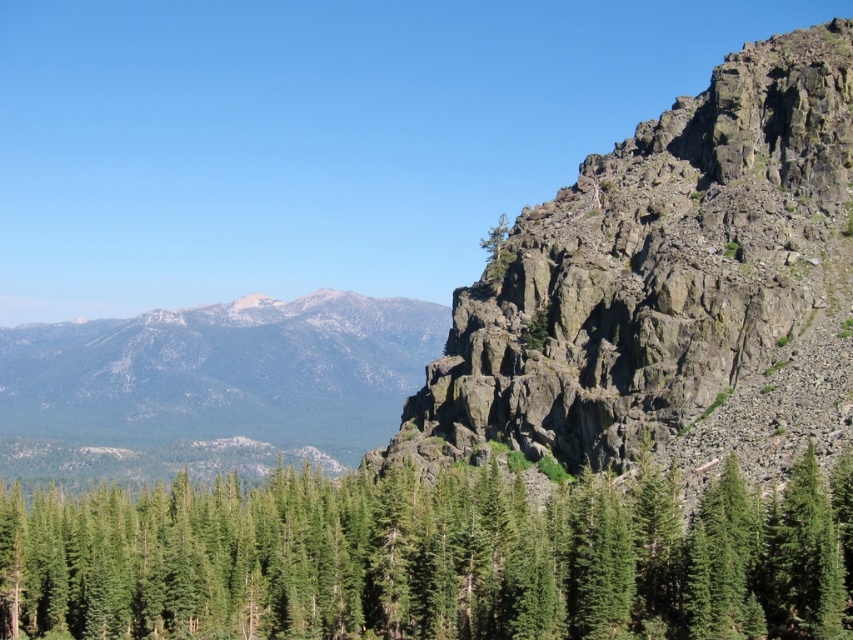
You are a hiker standing at the base of the cliff on the right side of the image. You want to take a photo of the green matte tree at center from your current position. Will the cliff block your view of the tree?

The green matte tree at center is located at point (431, 557) in the image. Since you are positioned at the base of the cliff on the right side, the cliff may block your view depending on the tree and cliff positions. However, without specific spatial relationships between the cliff and tree, it is impossible to determine if the cliff obstructs the view.

You are standing in the dense forest of coniferous trees in the image. You see a point marked at coordinates (431,557). What object does this point correspond to?

The point at coordinates (431,557) corresponds to the green matte tree at center.

You are a hiker standing at the base of the green matte tree at center and want to reach the rugged stone mountain at right. Which direction should you move to get closer to the mountain?

The green matte tree at center is in front of the rugged stone mountain at right, so to get closer to the mountain, you should move away from the tree towards the right direction where the mountain is located.